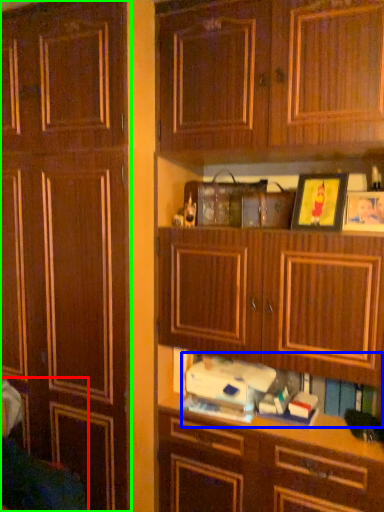
Question: Considering the real-world distances, which object is farthest from swivel chair (highlighted by a red box)? book (highlighted by a blue box) or cabinetry (highlighted by a green box)?

Choices:
 (A) book
 (B) cabinetry

Answer: (A)